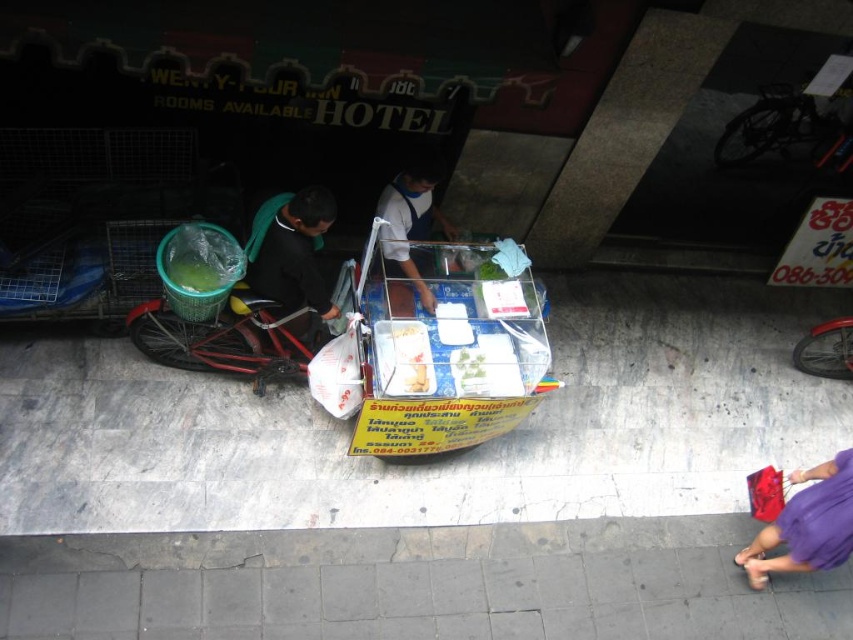
You are a delivery person who needs to place a dark green fabric bag at left on the gray concrete pavement at lower center. Can you fit the bag on the pavement?

The gray concrete pavement at lower center is bigger than the dark green fabric bag at left, so yes, the bag can fit on the pavement.